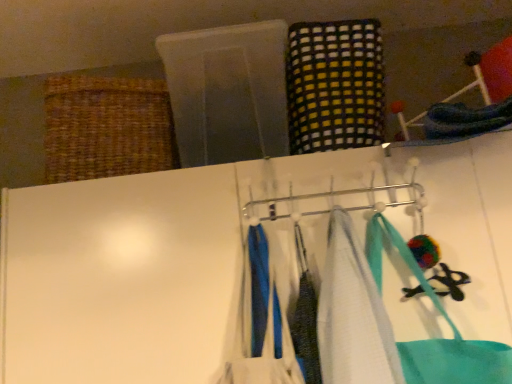
Question: From a real-world perspective, is blue fabric at center, which is the second clothing in right-to-left order, above or below metallic silver hanger at center?

Choices:
 (A) above
 (B) below

Answer: (B)

Question: In the image, is blue fabric at center, positioned as the 1th clothing in left-to-right order, on the left side or the right side of metallic silver hanger at center?

Choices:
 (A) left
 (B) right

Answer: (A)

Question: Considering the real-world distances, which object is farthest from the blue fabric at center, the 1th clothing positioned from the bottom?

Choices:
 (A) metallic silver hanger at center
 (B) white fabric towel at center
 (C) woven brown basket at upper left
 (D) multicolored woven cloth at upper center, marked as the 2th clothing in a bottom-to-top arrangement

Answer: (C)

Question: Which object is the closest to the multicolored woven cloth at upper center, marked as the second clothing in a front-to-back arrangement?

Choices:
 (A) metallic silver hanger at center
 (B) blue fabric at center, the 1th clothing positioned from the front
 (C) woven brown basket at upper left
 (D) white fabric towel at center

Answer: (A)